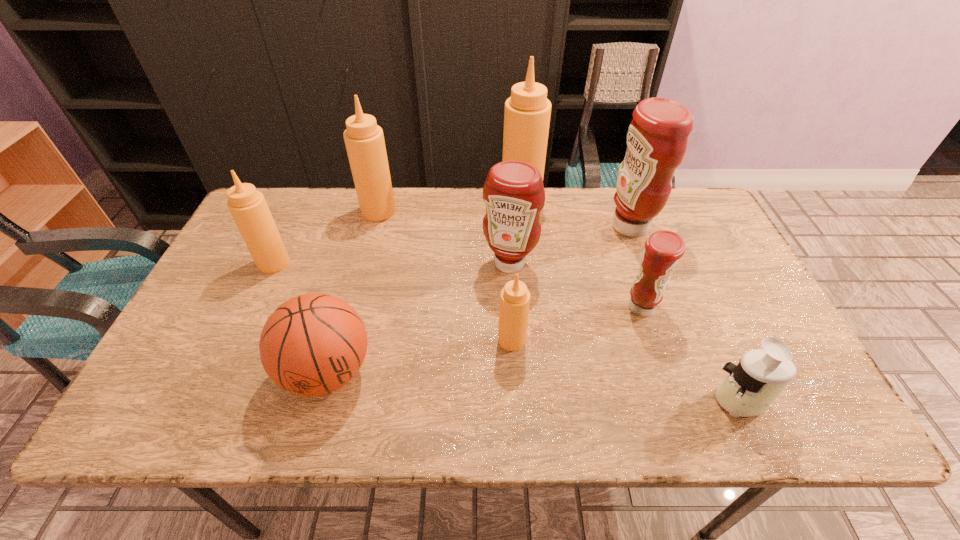
You are a GUI agent. You are given a task and a screenshot of the screen. Output one action in this format:
    pyautogui.click(x=<x>, y=<y>)
    Task: Click on the smallest red condiment
    
    Given the screenshot: What is the action you would take?
    pyautogui.click(x=663, y=249)

I want to click on the smallest tan condiment, so point(515,297).

Find the location of `the nearest tan condiment`. the nearest tan condiment is located at coordinates [x=515, y=297].

This screenshot has width=960, height=540. What are the coordinates of `orange basketball` in the screenshot? It's located at (313, 344).

Where is `juicer`? The image size is (960, 540). juicer is located at coordinates (750, 388).

The width and height of the screenshot is (960, 540). Find the location of `blank space located on the right of the tallest condiment`. blank space located on the right of the tallest condiment is located at coordinates (559, 200).

Where is `blank area located on the left of the sixth condiment from right to left`? blank area located on the left of the sixth condiment from right to left is located at coordinates (252, 211).

This screenshot has height=540, width=960. I want to click on free region located 0.090m on the back of the biggest red condiment, so click(617, 191).

You are a GUI agent. You are given a task and a screenshot of the screen. Output one action in this format:
    pyautogui.click(x=<x>, y=<y>)
    Task: Click on the free space located 0.140m on the front of the third farthest tan condiment
    This screenshot has height=540, width=960.
    Given the screenshot: What is the action you would take?
    pyautogui.click(x=251, y=313)

Locate an element on the screen. Image resolution: width=960 pixels, height=540 pixels. vacant space located on the front of the second biggest red condiment is located at coordinates (511, 291).